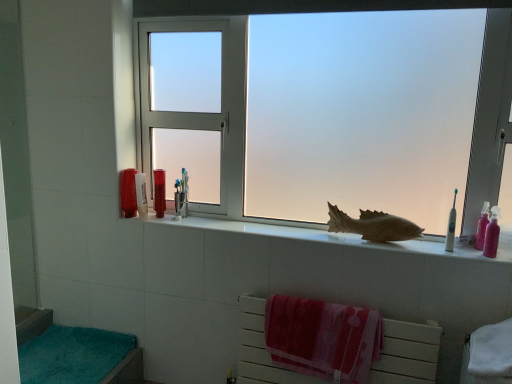
Question: Based on their positions, is teal plush bath towel at lower left located to the left or right of pink glossy toothbrush at right, placed as the first toiletry when sorted from right to left?

Choices:
 (A) left
 (B) right

Answer: (A)

Question: From their relative heights in the image, would you say teal plush bath towel at lower left is taller or shorter than pink glossy toothbrush at right, the 4th toiletry positioned from the back?

Choices:
 (A) tall
 (B) short

Answer: (B)

Question: Considering the real-world distances, which object is closest to the red cotton towel at lower center?

Choices:
 (A) translucent plastic cup at left, which is counted as the 1th toiletry, starting from the left
 (B) translucent plastic container at left, acting as the second toiletry starting from the left
 (C) white ceramic fish at center
 (D) translucent plastic cup at upper center, the 3th toiletry from the left
 (E) frosted glass window at center

Answer: (C)

Question: Which of these objects is positioned farthest from the brown matte fish at center?

Choices:
 (A) white plastic toothbrush at right
 (B) translucent plastic cup at upper center, the 3th toiletry from the left
 (C) white ceramic fish at center
 (D) red cotton towel at lower center
 (E) frosted glass window at center

Answer: (B)